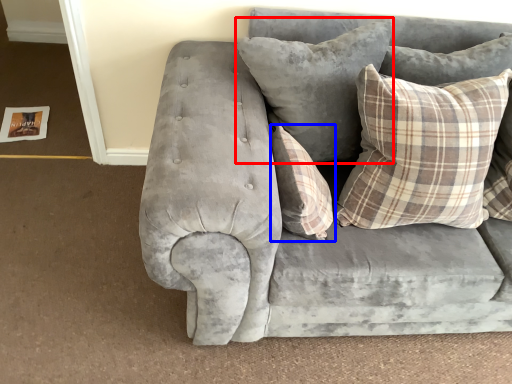
Question: Which of the following is the farthest to the observer, pillow (highlighted by a red box) or pillow (highlighted by a blue box)?

Choices:
 (A) pillow
 (B) pillow

Answer: (A)